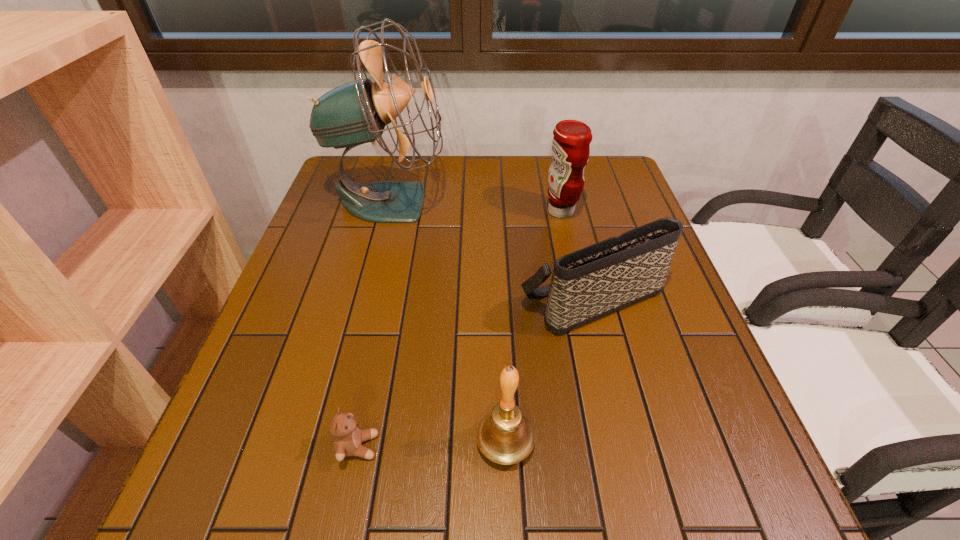
Where is `object that is the closest to the bell`? This screenshot has width=960, height=540. object that is the closest to the bell is located at coordinates (348, 438).

At what (x,y) coordinates should I click in order to perform the action: click on object that stands as the third closest to the handbag. Please return your answer as a coordinate pair (x, y). The image size is (960, 540). Looking at the image, I should click on (355, 113).

The image size is (960, 540). What are the coordinates of `free space that satisfies the following two spatial constraints: 1. on the front side of the condiment; 2. on the front-facing side of the teddy bear` in the screenshot? It's located at (613, 446).

I want to click on free spot that satisfies the following two spatial constraints: 1. on the front-facing side of the fan for air flow; 2. on the left side of the bell, so click(x=327, y=443).

This screenshot has width=960, height=540. I want to click on free space that satisfies the following two spatial constraints: 1. on the front side of the second shortest object; 2. on the left side of the condiment, so click(581, 299).

Where is `free space that satisfies the following two spatial constraints: 1. on the front-facing side of the fan for air flow; 2. on the left side of the fourth tallest object`? Image resolution: width=960 pixels, height=540 pixels. free space that satisfies the following two spatial constraints: 1. on the front-facing side of the fan for air flow; 2. on the left side of the fourth tallest object is located at coordinates (365, 299).